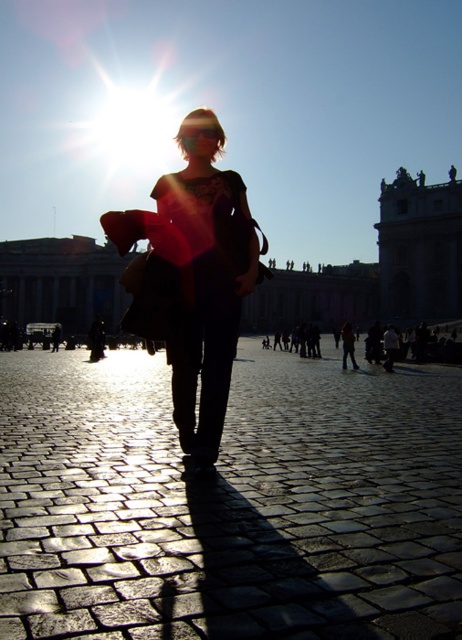
Question: Which object appears farthest from the camera in this image?

Choices:
 (A) cobblestone plaza at center
 (B) matte black coat at center
 (C) orange fabric bag at center
 (D) matte stone building at center

Answer: (D)

Question: In this image, where is matte stone building at center located relative to orange fabric bag at center?

Choices:
 (A) below
 (B) above

Answer: (B)

Question: Among these objects, which one is nearest to the camera?

Choices:
 (A) orange fabric bag at center
 (B) matte stone building at center

Answer: (A)

Question: In this image, where is matte stone building at center located relative to orange fabric bag at center?

Choices:
 (A) below
 (B) above

Answer: (B)

Question: Which point is closer to the camera taking this photo?

Choices:
 (A) (114, 253)
 (B) (328, 435)
 (C) (204, 289)

Answer: (C)

Question: Is matte stone building at center positioned before orange fabric bag at center?

Choices:
 (A) no
 (B) yes

Answer: (A)